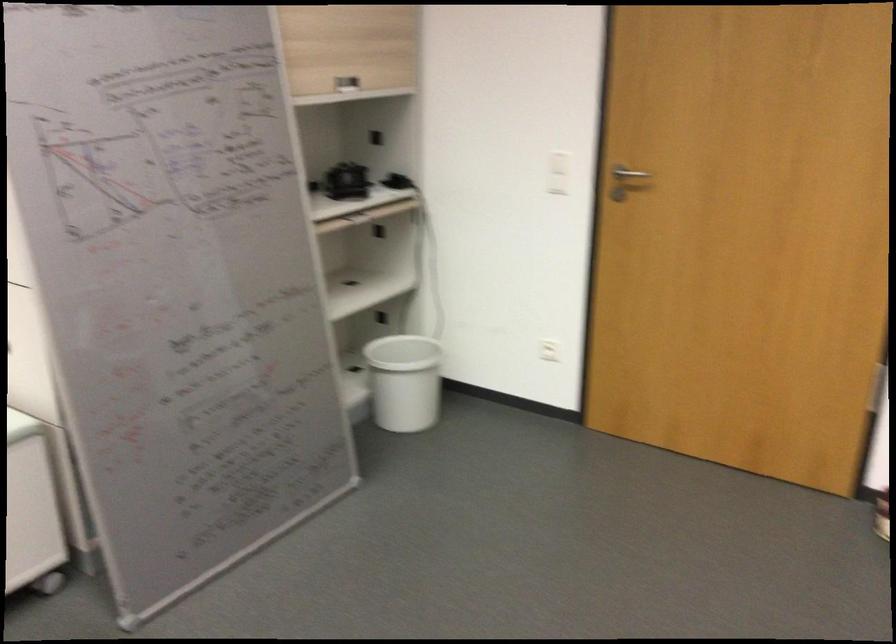
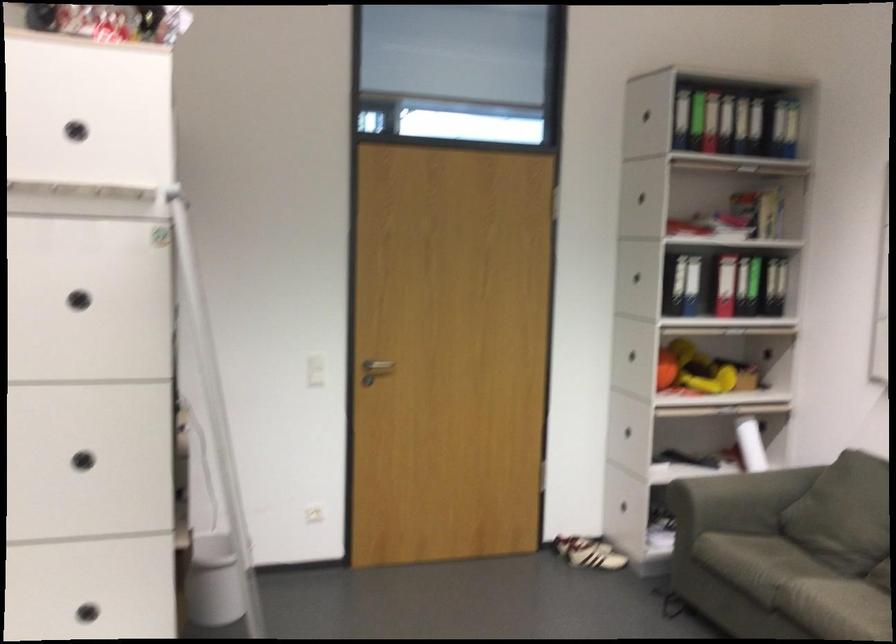
Where in the second image is the point corresponding to (431,393) from the first image?

(213, 581)